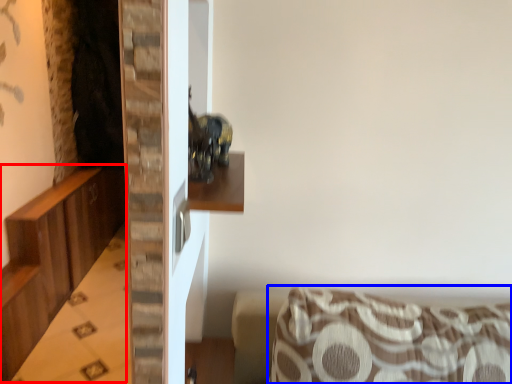
Question: Among these objects, which one is nearest to the camera, dresser (highlighted by a red box) or furniture (highlighted by a blue box)?

Choices:
 (A) dresser
 (B) furniture

Answer: (B)